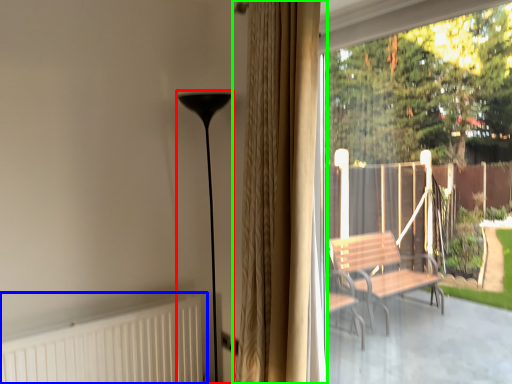
Question: Based on their relative distances, which object is nearer to lamp (highlighted by a red box)? Choose from radiator (highlighted by a blue box) and curtain (highlighted by a green box).

Choices:
 (A) radiator
 (B) curtain

Answer: (A)